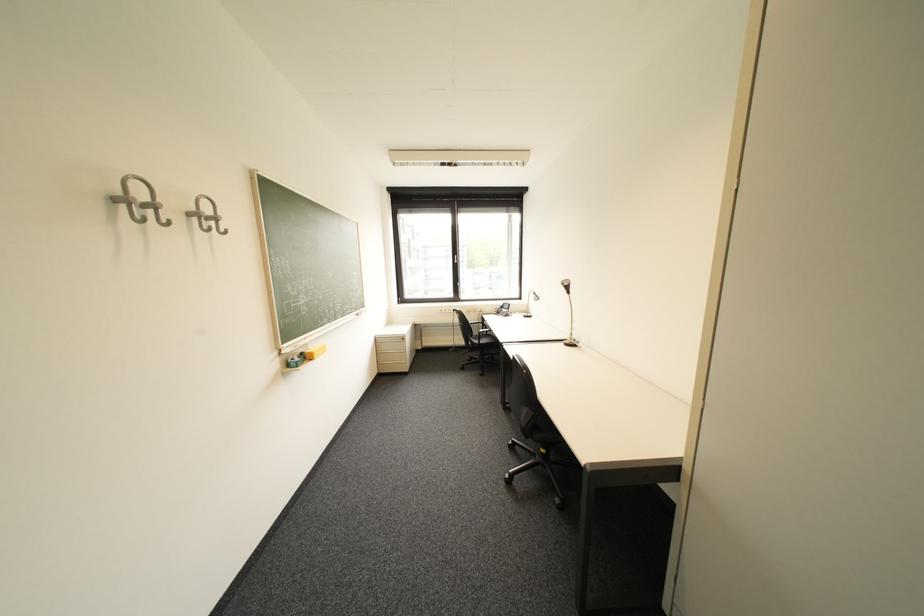
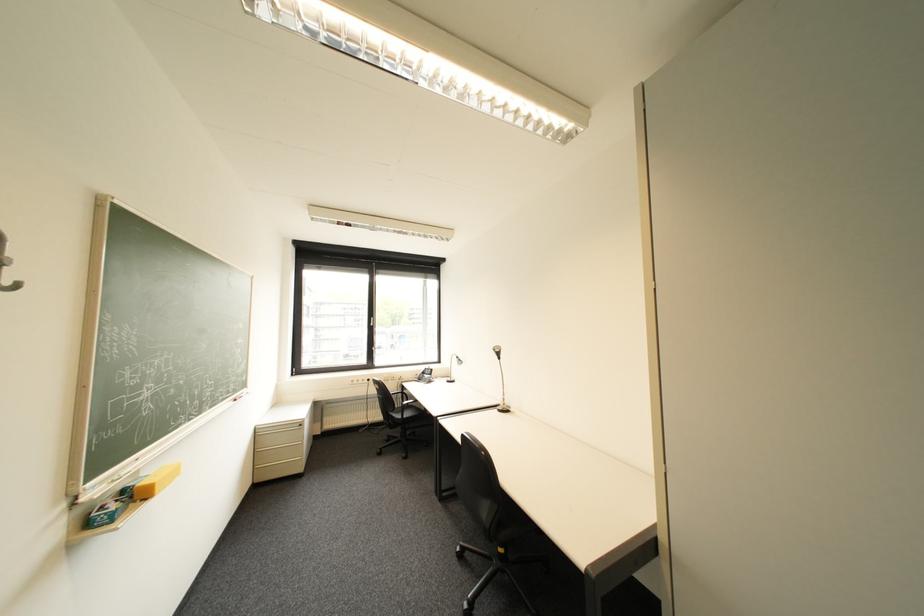
Question: How did the camera likely rotate?

Choices:
 (A) Left
 (B) Right
 (C) Up
 (D) Down

Answer: (B)